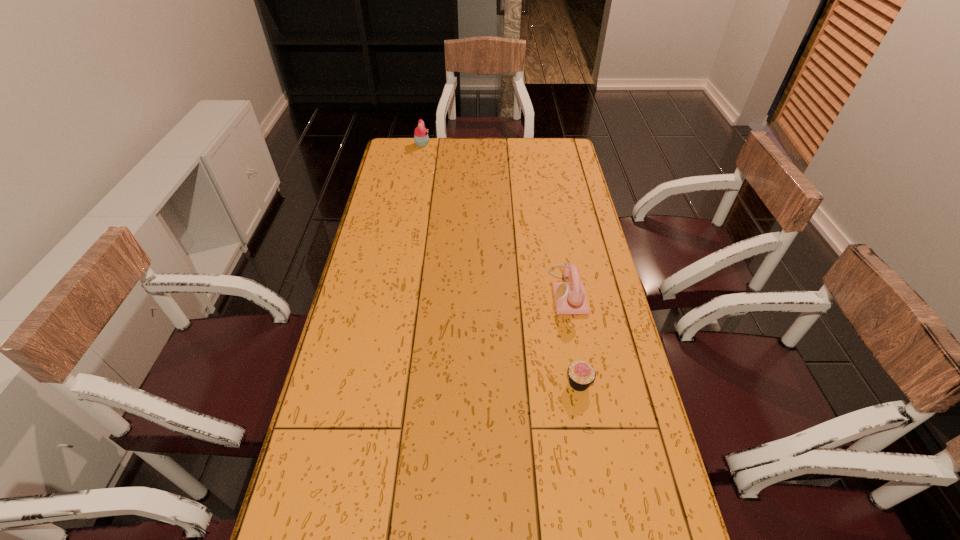
Where is `telephone`? Image resolution: width=960 pixels, height=540 pixels. telephone is located at coordinates (570, 298).

Locate an element on the screen. Image resolution: width=960 pixels, height=540 pixels. the leftmost object is located at coordinates (421, 138).

The width and height of the screenshot is (960, 540). I want to click on the farther cupcake, so click(x=421, y=138).

Image resolution: width=960 pixels, height=540 pixels. In order to click on the shortest object in this screenshot , I will do `click(581, 374)`.

Where is `the nearer cupcake`? the nearer cupcake is located at coordinates (581, 374).

Where is `free point located 0.140m on the dial of the telephone`? free point located 0.140m on the dial of the telephone is located at coordinates (509, 291).

Locate an element on the screen. This screenshot has height=540, width=960. vacant space located on the dial of the telephone is located at coordinates (454, 291).

You are a GUI agent. You are given a task and a screenshot of the screen. Output one action in this format:
    pyautogui.click(x=<x>, y=<y>)
    Task: Click on the free space located 0.120m on the dial of the telephone
    
    Given the screenshot: What is the action you would take?
    pyautogui.click(x=515, y=291)

This screenshot has height=540, width=960. I want to click on vacant space located 0.190m on the face of the left cupcake, so click(x=469, y=145).

At what (x,y) coordinates should I click in order to perform the action: click on vacant space located 0.060m on the front of the nearer cupcake. Please return your answer as a coordinate pair (x, y). This screenshot has width=960, height=540. Looking at the image, I should click on (585, 416).